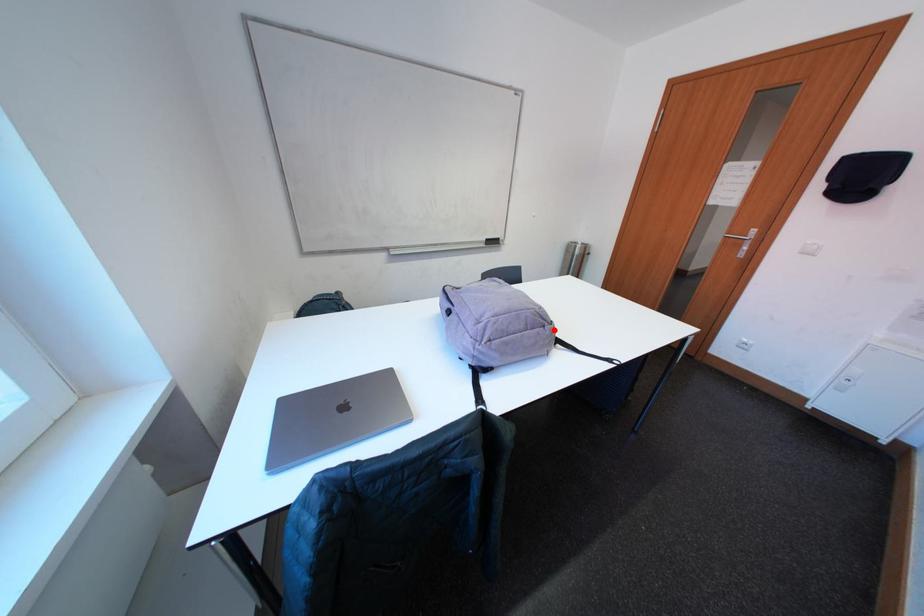
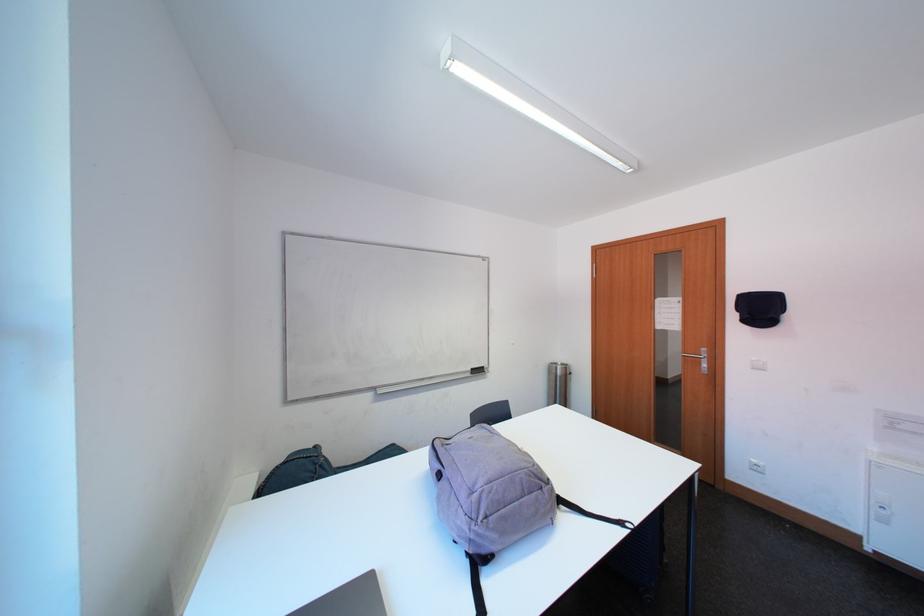
In the second image, find the point that corresponds to the highlighted location in the first image.

(551, 492)